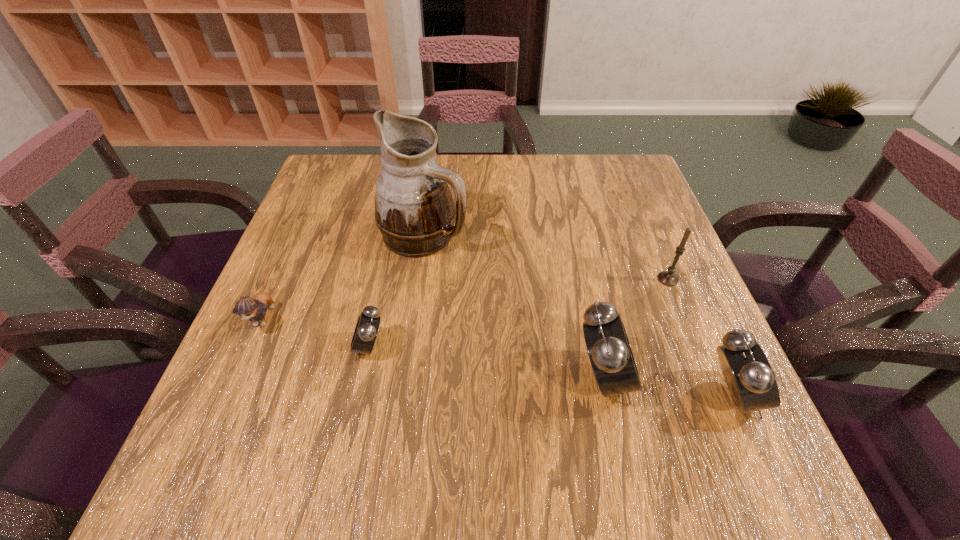
The width and height of the screenshot is (960, 540). I want to click on vacant area between the farthest object and the second shortest alarm clock, so click(578, 315).

In order to click on free space that is in between the farthest object and the leftmost object in this screenshot , I will do `click(345, 275)`.

The image size is (960, 540). I want to click on free spot between the farthest object and the leftmost object, so pos(345,275).

Locate an element on the screen. Image resolution: width=960 pixels, height=540 pixels. vacant space in between the shortest alarm clock and the tallest object is located at coordinates (396, 291).

Locate an element on the screen. unoccupied position between the leftmost alarm clock and the leftmost object is located at coordinates (317, 330).

Where is `the fourth closest object to the kitten`? The image size is (960, 540). the fourth closest object to the kitten is located at coordinates (668, 278).

Choose which object is the nearest neighbor to the third object from right to left. Please provide its 2D coordinates. Your answer should be formatted as a tuple, i.e. [(x, y)], where the tuple contains the x and y coordinates of a point satisfying the conditions above.

[(750, 379)]

Identify which alarm clock is located as the nearest to the leftmost object. Please provide its 2D coordinates. Your answer should be formatted as a tuple, i.e. [(x, y)], where the tuple contains the x and y coordinates of a point satisfying the conditions above.

[(366, 330)]

Where is `the second closest alarm clock to the candle`? the second closest alarm clock to the candle is located at coordinates (750, 379).